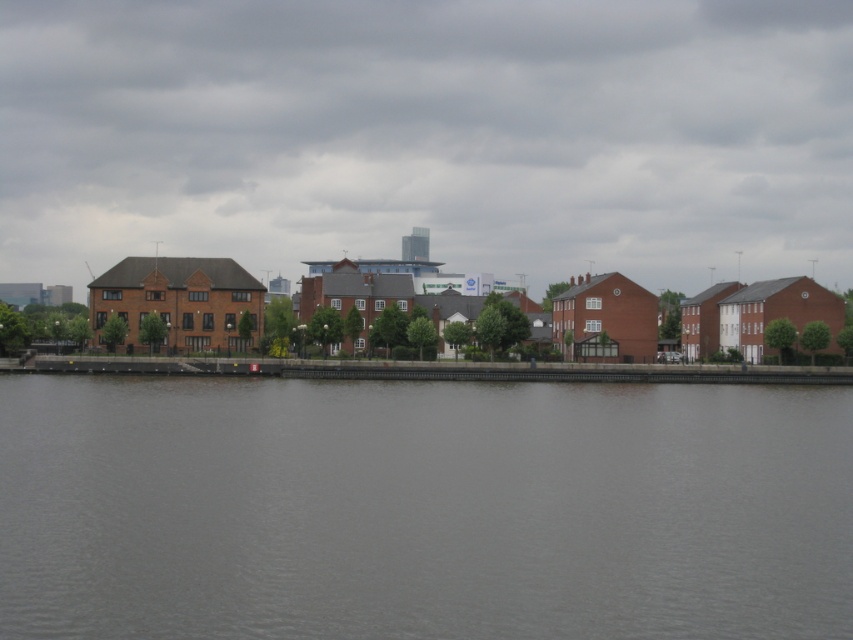
You are standing on the dock and want to take a photo of the matte brick buildings at center and the gray water at center. Which object will appear larger in the photo?

The matte brick buildings at center will appear larger in the photo because they are closer to the viewer than the gray water at center.

Based on the scene description and the coordinates provided, what does the point at coordinates (x=428, y=136) represent?

The point at coordinates (x=428, y=136) represents the matte brick buildings at center.

You are a photographer planning to capture the waterfront scene. You want to ensure that the matte brick buildings at center stand out prominently in your photo. Given their height relative to the gray water at center, how should you position your camera to emphasize their dominance in the composition?

The matte brick buildings at center are much taller than the gray water at center. To emphasize their dominance, position the camera lower to the ground so the buildings occupy more of the frame vertically, making them appear even more towering compared to the gray water at center.